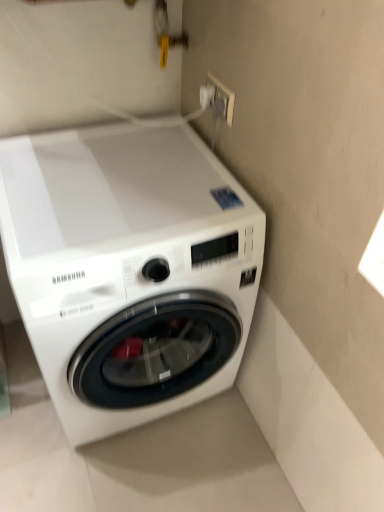
At what (x,y) coordinates should I click in order to perform the action: click on free space in front of white glossy washing machine at lower left. Please return your answer as a coordinate pair (x, y). This screenshot has width=384, height=512. Looking at the image, I should click on (126, 472).